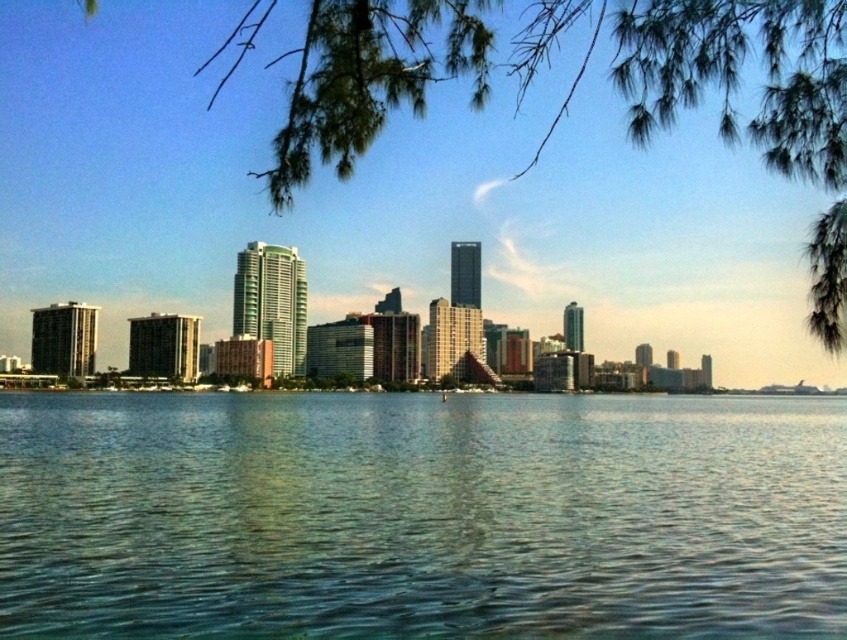
What do you see at coordinates (419, 516) in the screenshot?
I see `clear blue water at center` at bounding box center [419, 516].

Who is taller, clear blue water at center or green leafy tree at upper center?

Standing taller between the two is green leafy tree at upper center.

What do you see at coordinates (419, 516) in the screenshot?
I see `clear blue water at center` at bounding box center [419, 516].

Find the location of a particular element. Image resolution: width=847 pixels, height=640 pixels. clear blue water at center is located at coordinates (419, 516).